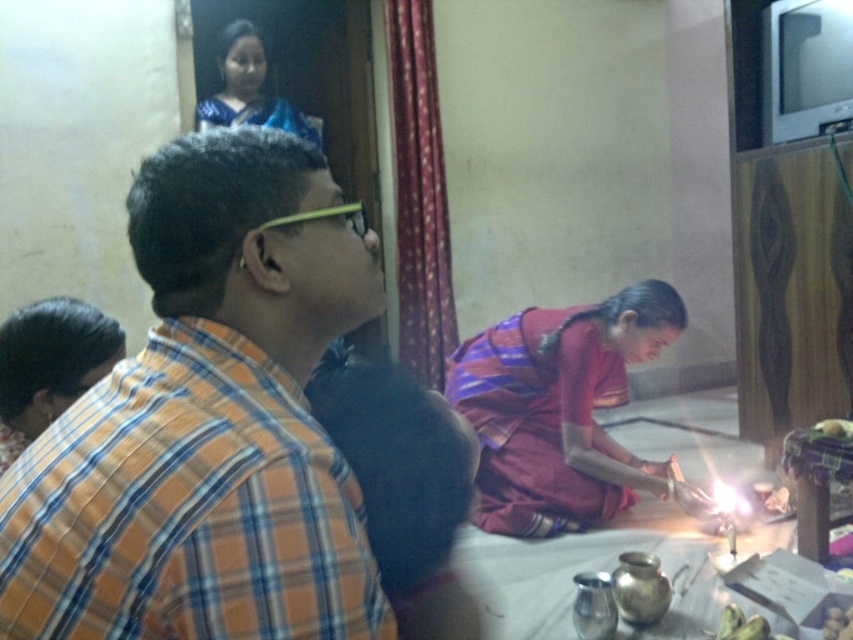
Question: Where is orange plaid shirt at left located in relation to dark brown hair at lower left in the image?

Choices:
 (A) right
 (B) left

Answer: (A)

Question: Among these objects, which one is nearest to the camera?

Choices:
 (A) smooth yellow banana at lower right
 (B) maroon silk saree at lower center
 (C) white glossy food at lower right
 (D) dark brown hair at lower left

Answer: (D)

Question: Is blue sari at upper center in front of smooth yellow banana at lower right?

Choices:
 (A) yes
 (B) no

Answer: (B)

Question: Among these objects, which one is nearest to the camera?

Choices:
 (A) maroon silk saree at lower center
 (B) dark brown hair at lower left
 (C) orange plaid shirt at left

Answer: (C)

Question: Is orange plaid shirt at left to the left of smooth yellow banana at lower right from the viewer's perspective?

Choices:
 (A) no
 (B) yes

Answer: (B)

Question: Which point is closer to the camera taking this photo?

Choices:
 (A) (44, 380)
 (B) (74, 563)

Answer: (B)